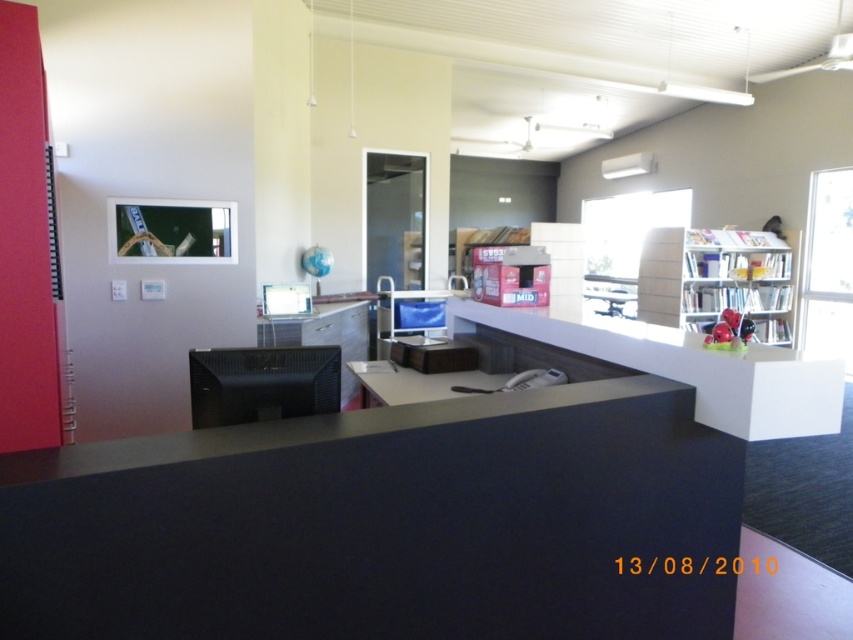
You are standing in the office and need to place a new plant on the matte black desk at center. Where exactly should you place it?

The matte black desk at center is located at point 2D coordinates of (x=386, y=524), so place the plant at that position.

Consider the image. You are a delivery person entering the office and need to place a package on the white glossy counter top at center. However, there is a black plastic computer at center in the way. Can you place the package on the counter top without moving the computer?

The white glossy counter top at center is located below the black plastic computer at center, so you can place the package on the counter top without moving the computer since the computer is above it.